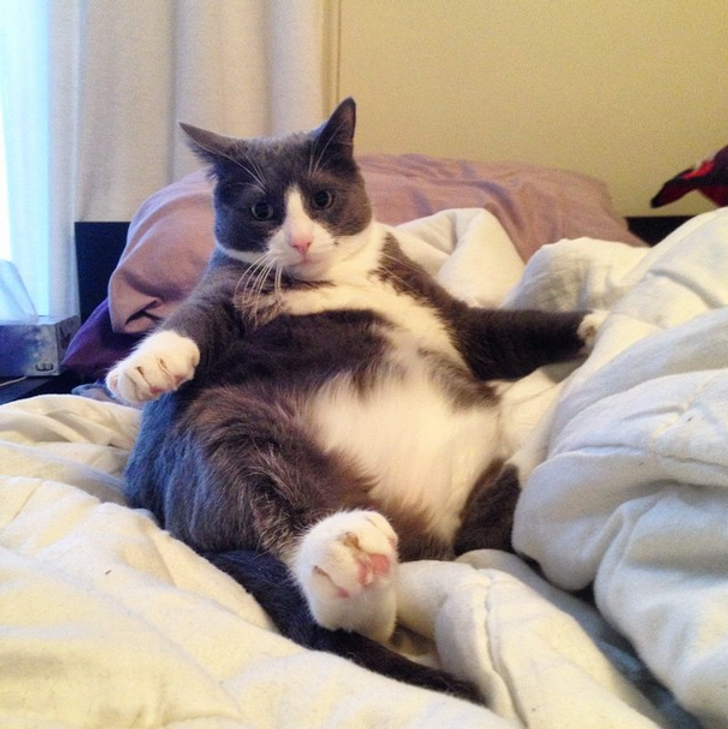
Identify the location of blanket. The image size is (728, 729). (638, 399).